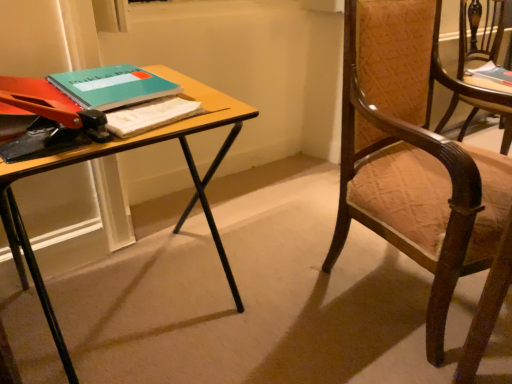
Question: From a real-world perspective, is teal matte notebook at upper left, arranged as the second book when viewed from the right, physically located above or below teal matte book at upper right, which is the first book in right-to-left order?

Choices:
 (A) below
 (B) above

Answer: (B)

Question: From the image's perspective, is teal matte notebook at upper left, arranged as the second book when viewed from the right, located above or below teal matte book at upper right, which appears as the 2th book when viewed from the left?

Choices:
 (A) above
 (B) below

Answer: (B)

Question: Considering the real-world distances, which object is closest to the wooden chair with upholstered seat at right, which appears as the 2th chair when viewed from the back?

Choices:
 (A) teal matte notebook at upper left, arranged as the second book when viewed from the right
 (B) wooden textured chair at right, acting as the 1th chair starting from the right
 (C) teal matte book at upper right, which is the first book in right-to-left order
 (D) wooden desk at center

Answer: (D)

Question: Which object is the closest to the teal matte notebook at upper left, which is the first book from bottom to top?

Choices:
 (A) teal matte book at upper right, placed as the 2th book when sorted from bottom to top
 (B) wooden chair with upholstered seat at right, which is counted as the 1th chair, starting from the front
 (C) wooden textured chair at right, acting as the 1th chair starting from the right
 (D) wooden desk at center

Answer: (D)